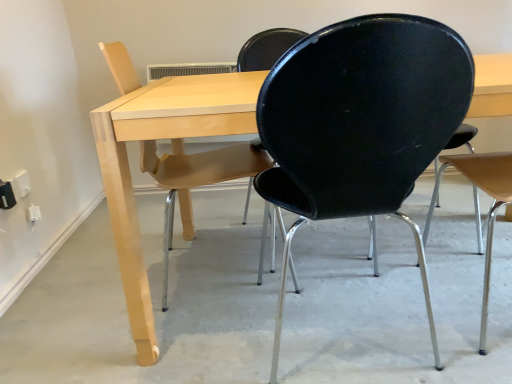
I want to click on vacant location below light wood table at center (from a real-world perspective), so click(x=369, y=266).